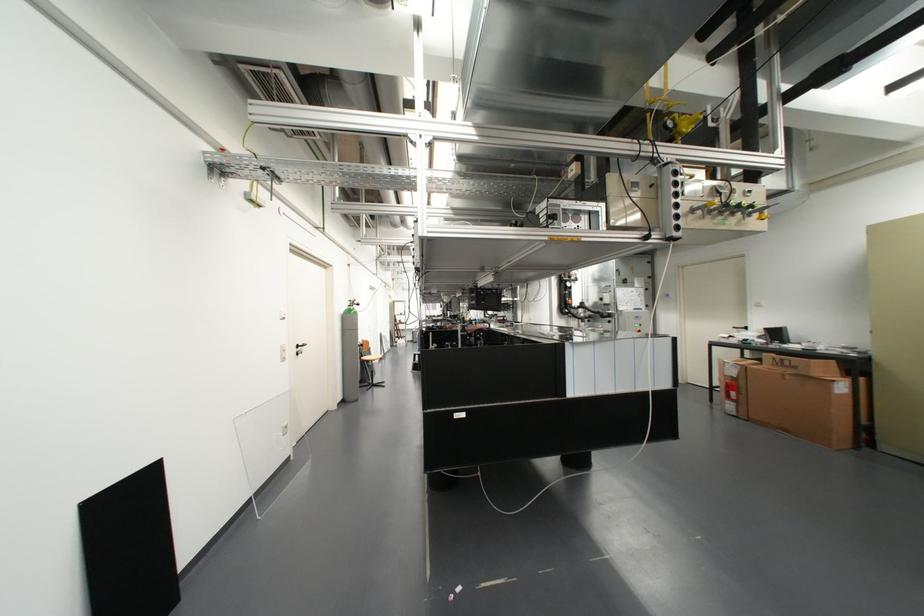
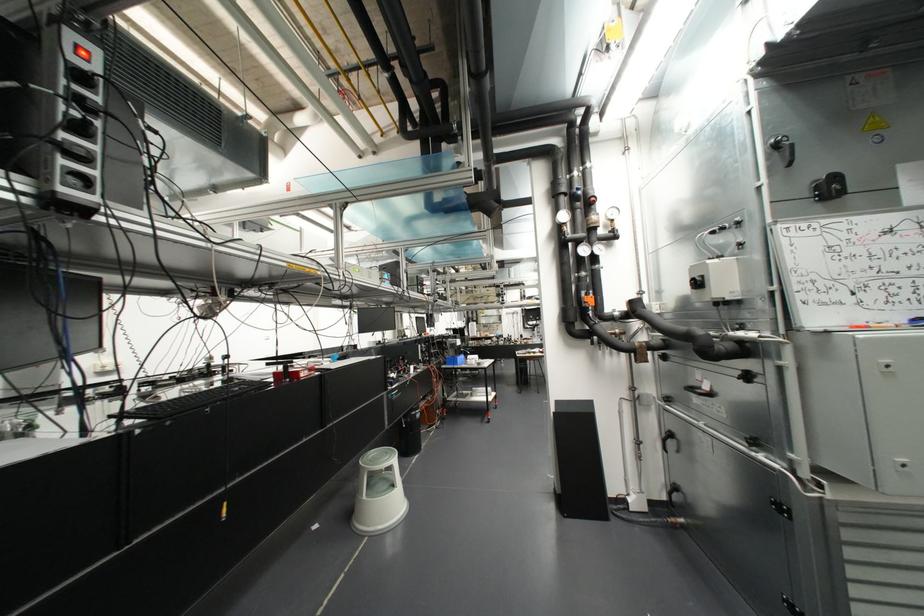
In a continuous first-person perspective shot, in which direction is the camera moving?

The movement direction of the cameraman is right, forward.